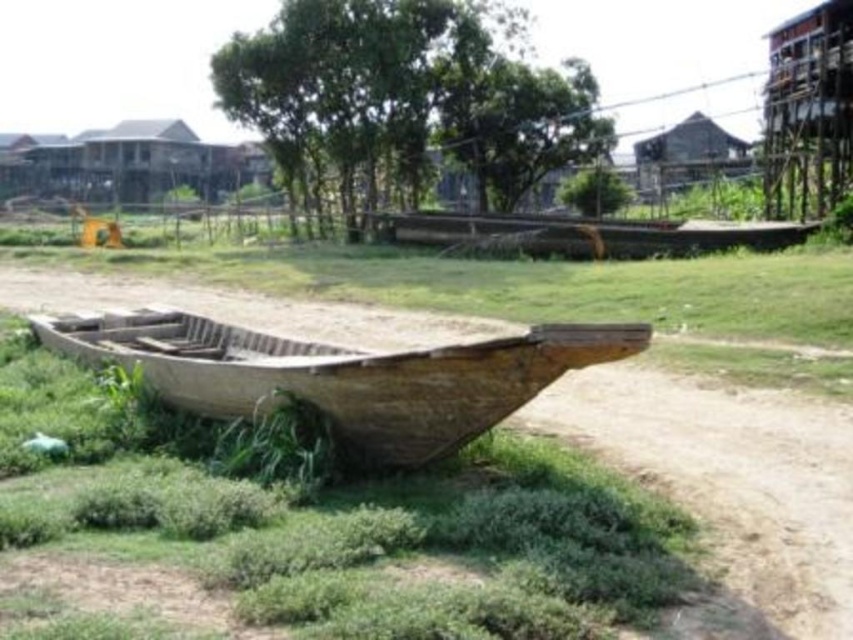
Does brown dirt track at lower right have a greater width compared to wooden canoe at center?

In fact, brown dirt track at lower right might be narrower than wooden canoe at center.

Does brown dirt track at lower right have a lesser height compared to wooden canoe at center?

Yes.

The image size is (853, 640). Describe the element at coordinates (730, 477) in the screenshot. I see `brown dirt track at lower right` at that location.

The image size is (853, 640). I want to click on brown dirt track at lower right, so click(x=730, y=477).

Does weathered wood boat at center lie in front of brown wooden hut at upper right?

Yes, it is.

Which is above, weathered wood boat at center or brown wooden hut at upper right?

brown wooden hut at upper right

The width and height of the screenshot is (853, 640). Describe the element at coordinates (341, 372) in the screenshot. I see `weathered wood boat at center` at that location.

At what (x,y) coordinates should I click in order to perform the action: click on weathered wood boat at center. Please return your answer as a coordinate pair (x, y). Looking at the image, I should click on (341, 372).

Who is taller, wooden canoe at center or brown wooden hut at upper right?

brown wooden hut at upper right

Who is more forward, (x=751, y=227) or (x=715, y=145)?

Point (x=751, y=227) is in front.

Between point (782, 225) and point (727, 170), which one is positioned behind?

Positioned behind is point (727, 170).

You are a GUI agent. You are given a task and a screenshot of the screen. Output one action in this format:
    pyautogui.click(x=<x>, y=<y>)
    Task: Click on the wooden canoe at center
    The image size is (853, 640).
    Given the screenshot: What is the action you would take?
    pyautogui.click(x=581, y=234)